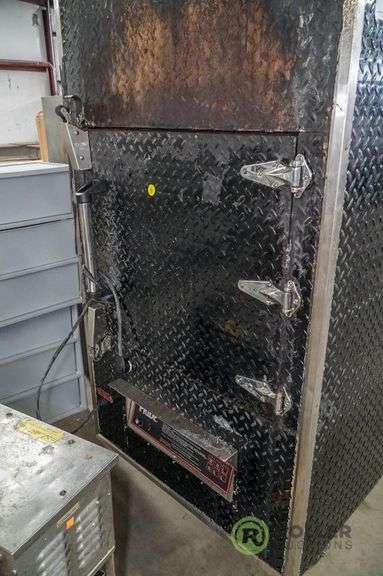
This screenshot has height=576, width=383. Identify the location of door handle. (83, 240).